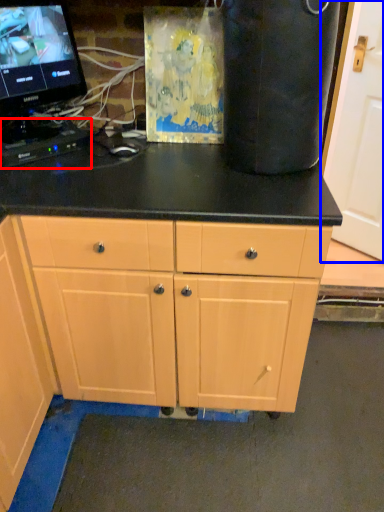
Question: Which object appears closest to the camera in this image, computer keyboard (highlighted by a red box) or door (highlighted by a blue box)?

Choices:
 (A) computer keyboard
 (B) door

Answer: (A)